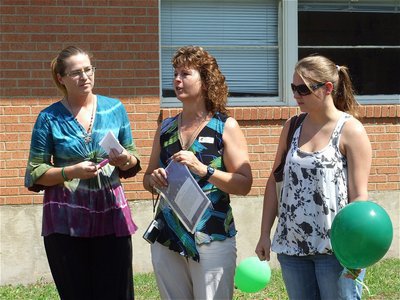
I want to click on window, so click(x=222, y=24).